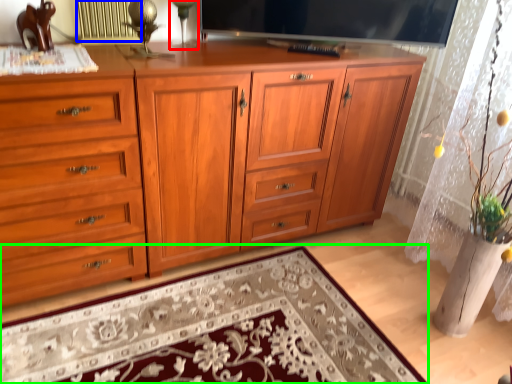
Question: Which object is positioned farthest from table lamp (highlighted by a red box)? Select from radiator (highlighted by a blue box) and mat (highlighted by a green box).

Choices:
 (A) radiator
 (B) mat

Answer: (B)